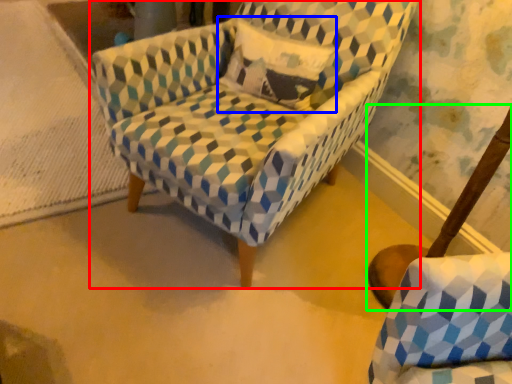
Question: Estimate the real-world distances between objects in this image. Which object is farther from chair (highlighted by a red box), throw pillow (highlighted by a blue box) or swivel chair (highlighted by a green box)?

Choices:
 (A) throw pillow
 (B) swivel chair

Answer: (B)